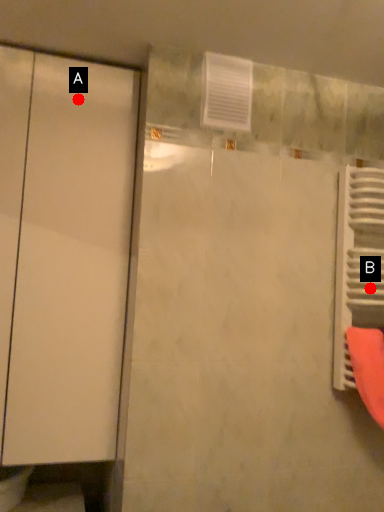
Question: Two points are circled on the image, labeled by A and B beside each circle. Among these points, which one is farthest from the camera?

Choices:
 (A) A is further
 (B) B is further

Answer: (A)